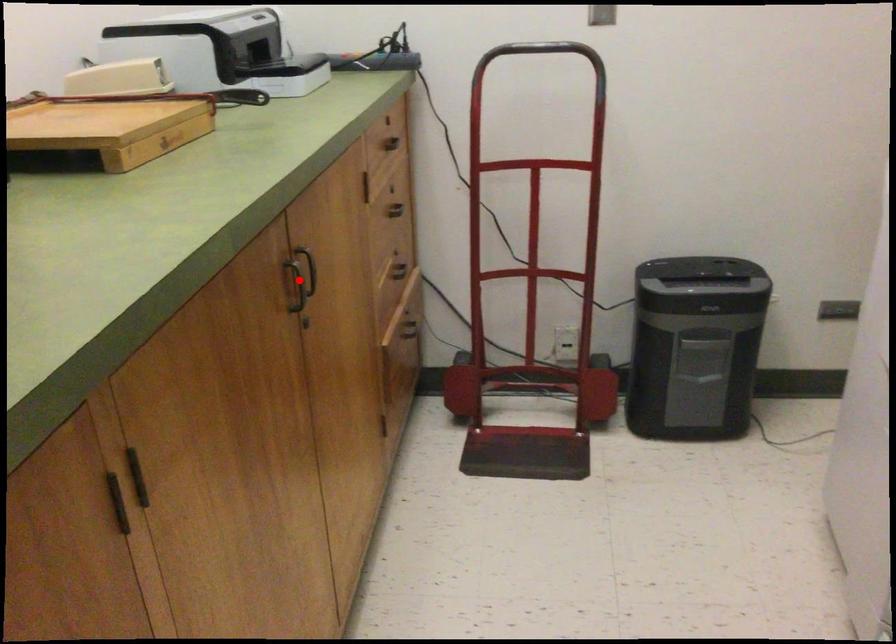
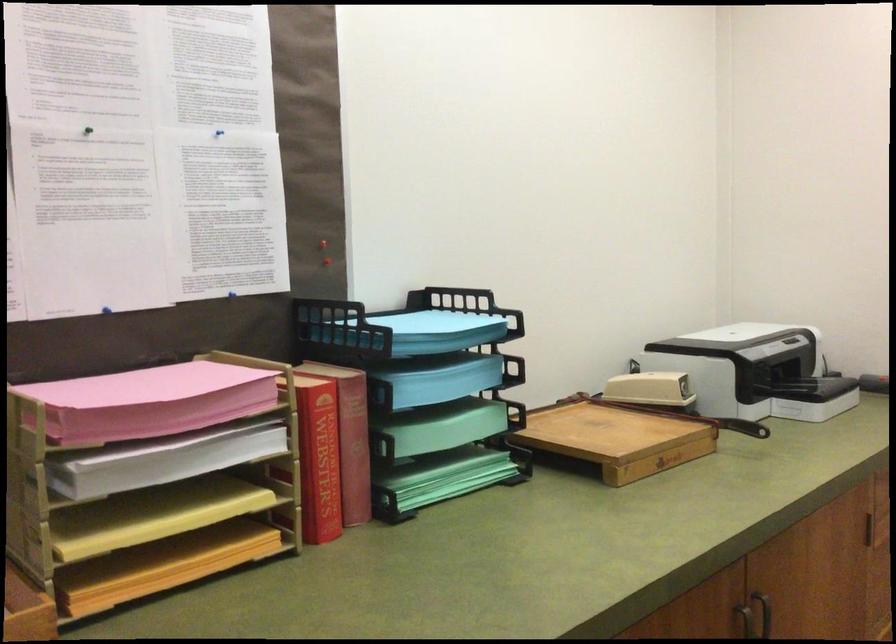
Locate, in the second image, the point that corresponds to the highlighted location in the first image.

(746, 623)